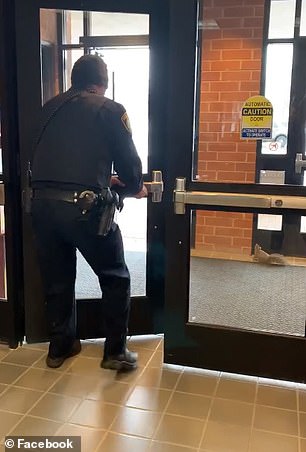
The image size is (306, 452). What are the coordinates of `yellow circle sticker` in the screenshot? It's located at (257, 97).